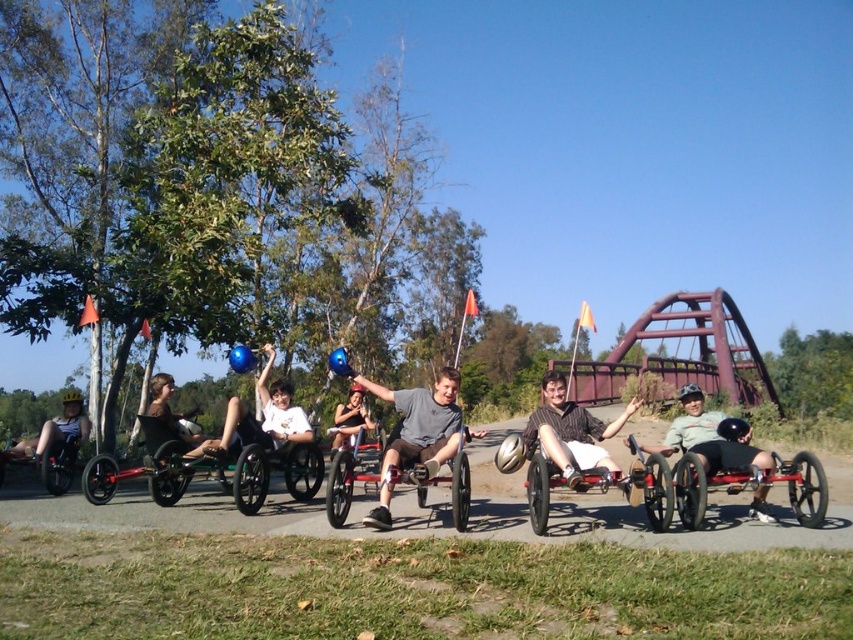
You are a photographer standing in the park and want to take a photo of the metallic silver wheelchair at center and the white cotton shirt at center. Which object should you focus on first to ensure both are in focus?

You should focus on the metallic silver wheelchair at center first because it is closer to the viewer than the white cotton shirt at center, so adjusting focus from near to far will help both be in focus.

You are standing at the point with coordinates point (572, 432) in the image. What object is located at that point?

The point (572, 432) corresponds to the striped shirt at center.

You are planning to take a metallic silver wheelchair at center and a matte black helmet at left into a small elevator. The elevator has a weight limit of 500 kg. If the wheelchair weighs 300 kg and the helmet weighs 2 kg, can both items be safely transported together?

The metallic silver wheelchair at center weighs 300 kg and the matte black helmet at left weighs 2 kg. Combined, they total 302 kg, which is under the 500 kg weight limit. Both items can be safely transported together.